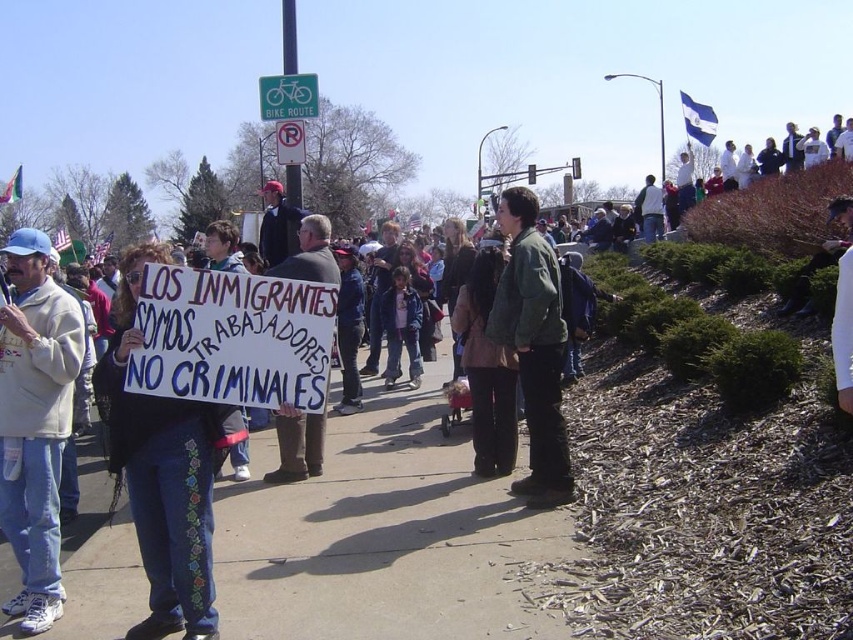
You are a photographer standing at the center of the sidewalk. You want to take a photo of both the point at (x=32, y=465) and the point at (x=325, y=416). Which point should you focus on first to ensure both are in the frame?

You should focus on point (x=32, y=465) first because it is in front of point (x=325, y=416), so by focusing on the closer point, both points will be in the frame.

You are a photographer trying to capture the protest scene. You notice a person wearing a white fleece sweatshirt at center. Where exactly is this person positioned in the image?

The white fleece sweatshirt at center is located at point 0.659 on the x axis and 0.042 on the y axis.